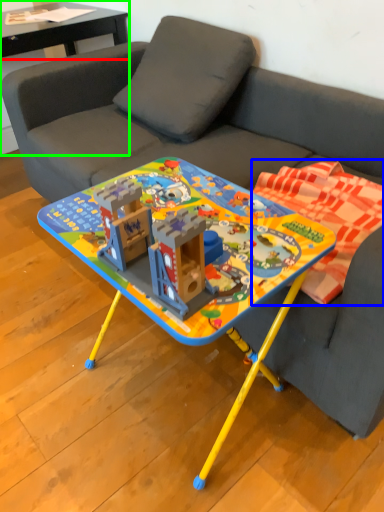
Question: Which object is the closest to the table (highlighted by a red box)? Choose among these: blanket (highlighted by a blue box) or side table (highlighted by a green box).

Choices:
 (A) blanket
 (B) side table

Answer: (B)